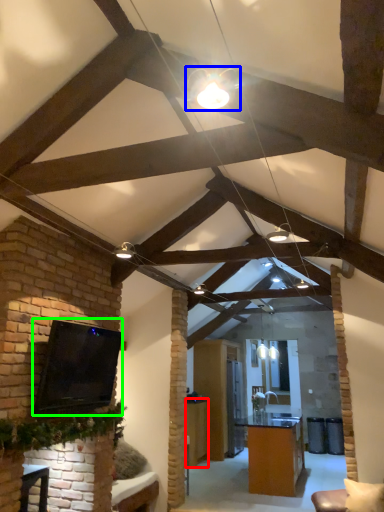
Question: Based on their relative distances, which object is farther from table (highlighted by a red box)? Choose from light fixture (highlighted by a blue box) and open (highlighted by a green box).

Choices:
 (A) light fixture
 (B) open

Answer: (A)